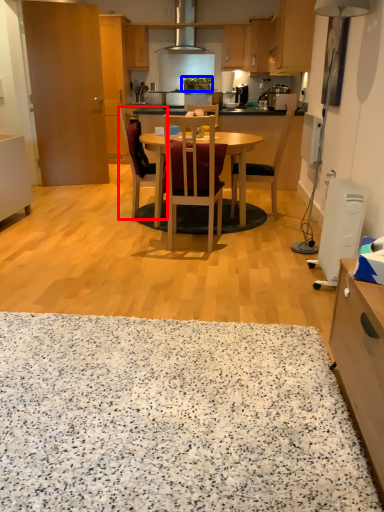
Question: Among these objects, which one is nearest to the camera, chair (highlighted by a red box) or pot/pan (highlighted by a blue box)?

Choices:
 (A) chair
 (B) pot/pan

Answer: (A)